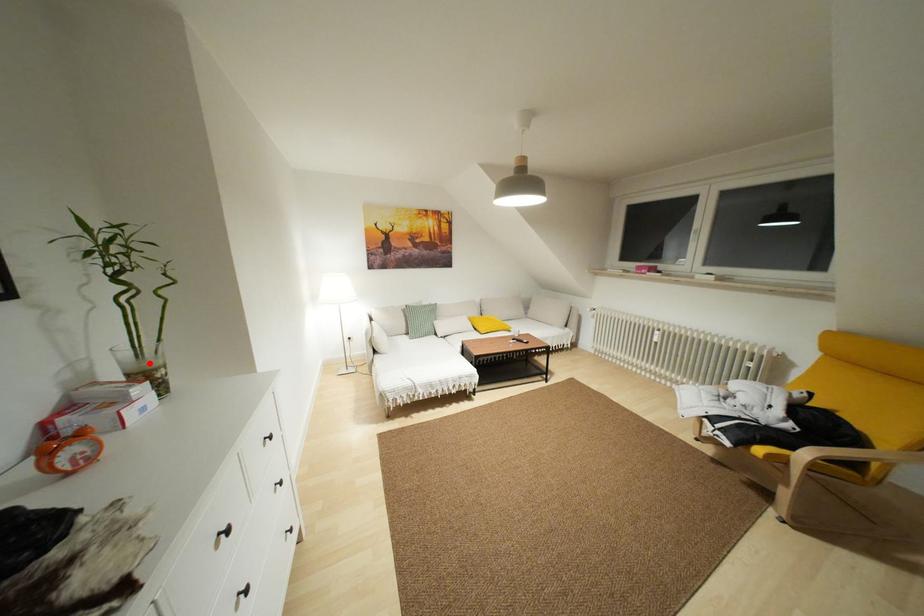
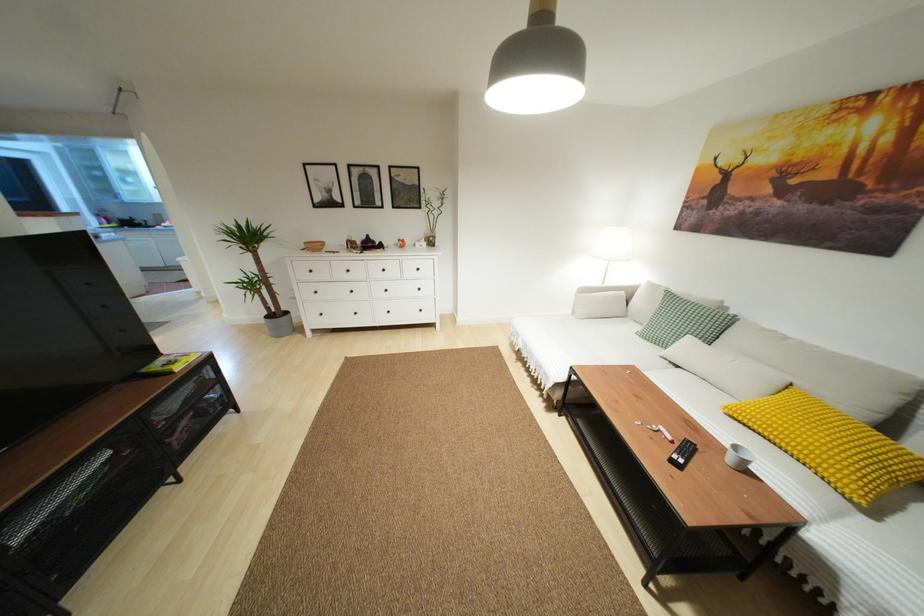
Where in the second image is the point corresponding to the highlighted location from the first image?

(430, 233)